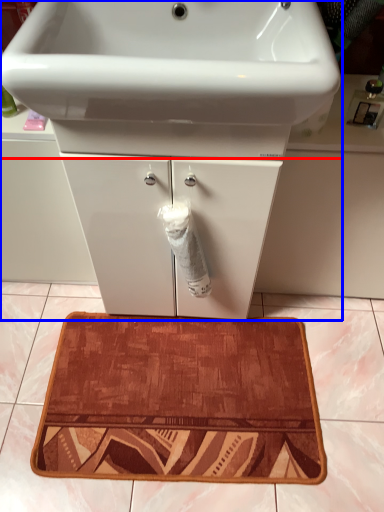
Question: Among these objects, which one is farthest to the camera, sink (highlighted by a red box) or bathroom cabinet (highlighted by a blue box)?

Choices:
 (A) sink
 (B) bathroom cabinet

Answer: (B)